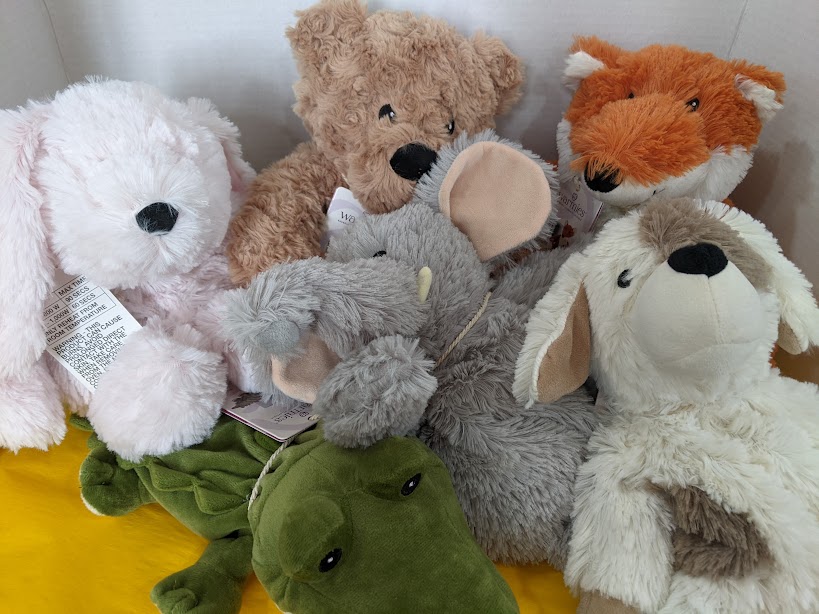
Locate an element on the screen. The height and width of the screenshot is (614, 819). stuffed animals is located at coordinates (159, 188), (405, 72), (627, 125), (680, 223), (487, 381), (409, 511).